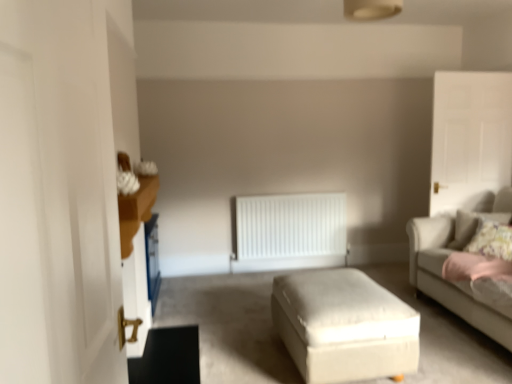
Question: From a real-world perspective, is white fabric ottoman at center under white matte radiator at center?

Choices:
 (A) yes
 (B) no

Answer: (A)

Question: Is white matte radiator at center a part of white fabric ottoman at center?

Choices:
 (A) yes
 (B) no

Answer: (B)

Question: Is white fabric ottoman at center oriented towards white matte radiator at center?

Choices:
 (A) no
 (B) yes

Answer: (A)

Question: Is white fabric ottoman at center directly adjacent to white matte radiator at center?

Choices:
 (A) yes
 (B) no

Answer: (B)

Question: Is white fabric ottoman at center located outside white matte radiator at center?

Choices:
 (A) yes
 (B) no

Answer: (A)

Question: From the image's perspective, is white matte radiator at center positioned above or below white glossy door at left, positioned as the first glass door in front-to-back order?

Choices:
 (A) below
 (B) above

Answer: (A)

Question: From a real-world perspective, is white matte radiator at center physically located above or below white glossy door at left, acting as the 2th glass door starting from the right?

Choices:
 (A) below
 (B) above

Answer: (A)

Question: Is white matte radiator at center inside the boundaries of white glossy door at left, arranged as the second glass door when viewed from the back, or outside?

Choices:
 (A) inside
 (B) outside

Answer: (B)

Question: Considering the positions of point (292, 215) and point (20, 173), is point (292, 215) closer or farther from the camera than point (20, 173)?

Choices:
 (A) closer
 (B) farther

Answer: (B)

Question: From a real-world perspective, is white matte radiator at center positioned above or below fluffy floral pillow at right?

Choices:
 (A) below
 (B) above

Answer: (A)

Question: In the image, is white matte radiator at center positioned in front of or behind fluffy floral pillow at right?

Choices:
 (A) front
 (B) behind

Answer: (B)

Question: From the image's perspective, is white matte radiator at center above or below fluffy floral pillow at right?

Choices:
 (A) above
 (B) below

Answer: (B)

Question: Which is correct: white matte radiator at center is inside fluffy floral pillow at right, or outside of it?

Choices:
 (A) outside
 (B) inside

Answer: (A)

Question: In terms of width, does white matte radiator at center look wider or thinner when compared to white glossy door at upper right, acting as the 2th glass door starting from the front?

Choices:
 (A) wide
 (B) thin

Answer: (A)

Question: Is white matte radiator at center taller or shorter than white glossy door at upper right, the first glass door from the back?

Choices:
 (A) short
 (B) tall

Answer: (A)